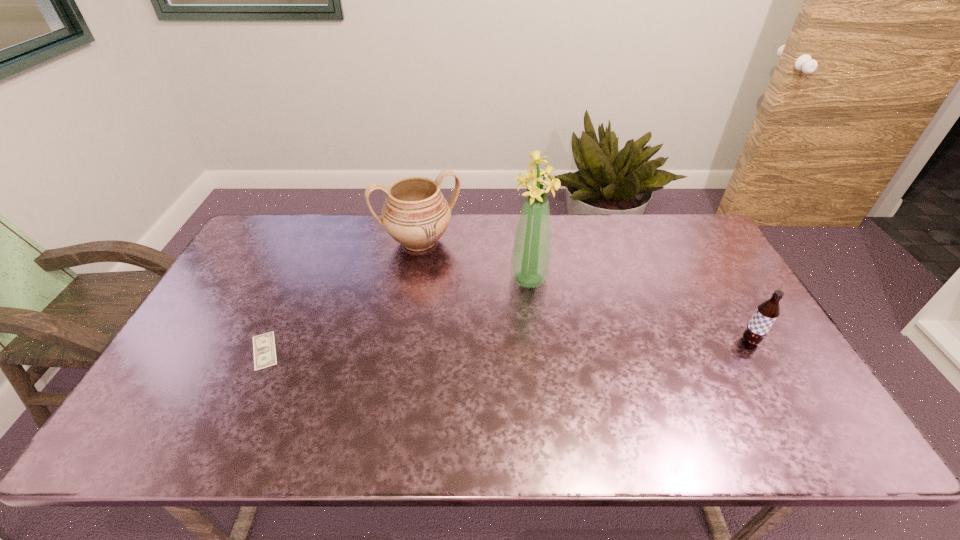
You are a GUI agent. You are given a task and a screenshot of the screen. Output one action in this format:
    pyautogui.click(x=<x>, y=<y>)
    Task: Click on the free spot on the desktop that is between the leftmost object and the third tallest object and is positioned on the front-facing side of the urn
    
    Given the screenshot: What is the action you would take?
    pyautogui.click(x=469, y=347)

The width and height of the screenshot is (960, 540). Find the location of `free space on the desktop that is between the shortest object and the root beer and is positioned on the front-facing side of the third nearest object`. free space on the desktop that is between the shortest object and the root beer and is positioned on the front-facing side of the third nearest object is located at coordinates (576, 345).